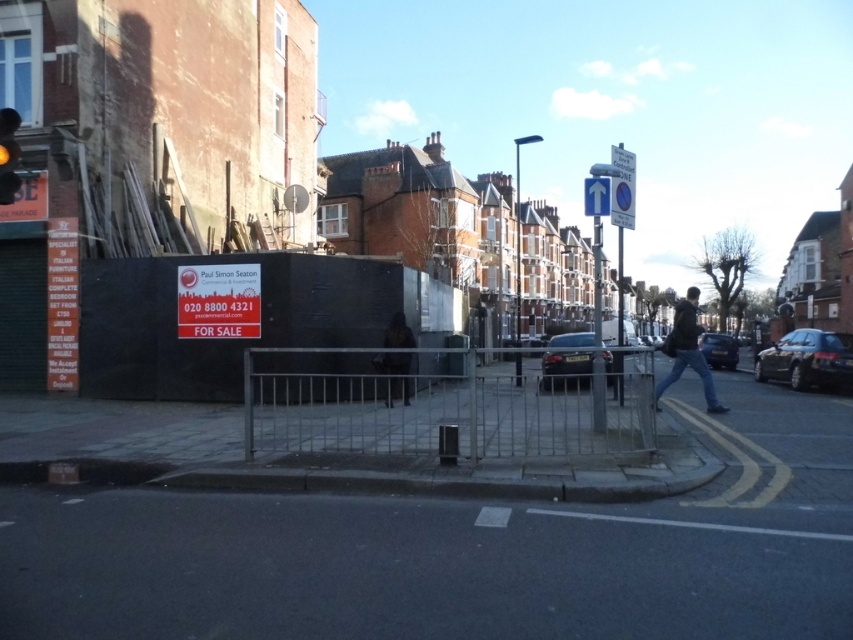
From the picture: Who is taller, black metallic car at center or dark brown fur coat at center?

dark brown fur coat at center is taller.

Between point (585, 371) and point (389, 321), which one is positioned behind?

The point (585, 371) is behind.

Locate an element on the screen. black metallic car at center is located at coordinates (566, 368).

Can you confirm if black metallic car at center is positioned above shiny black car at lower right?

Indeed, black metallic car at center is positioned over shiny black car at lower right.

Between black metallic car at center and shiny black car at lower right, which one is positioned lower?

shiny black car at lower right is below.

Which is in front, point (582, 342) or point (724, 349)?

Point (582, 342) is more forward.

I want to click on black metallic car at center, so click(566, 368).

Which is more to the right, dark gray jacket at center right or red glass traffic light at upper left?

From the viewer's perspective, dark gray jacket at center right appears more on the right side.

Is dark gray jacket at center right wider than red glass traffic light at upper left?

Yes.

What are the coordinates of `dark gray jacket at center right` in the screenshot? It's located at (688, 352).